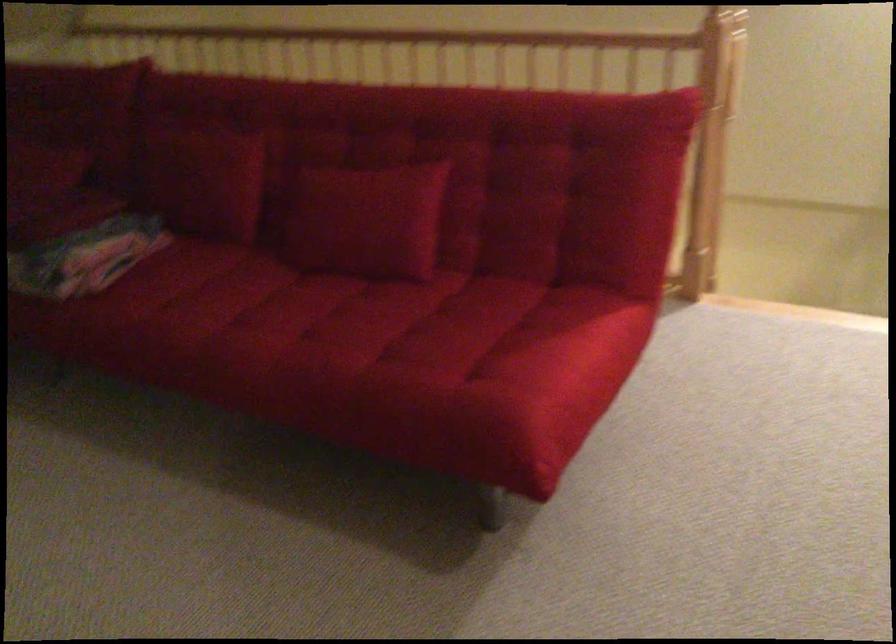
This screenshot has width=896, height=644. What do you see at coordinates (290, 310) in the screenshot?
I see `a sofa sitting surface` at bounding box center [290, 310].